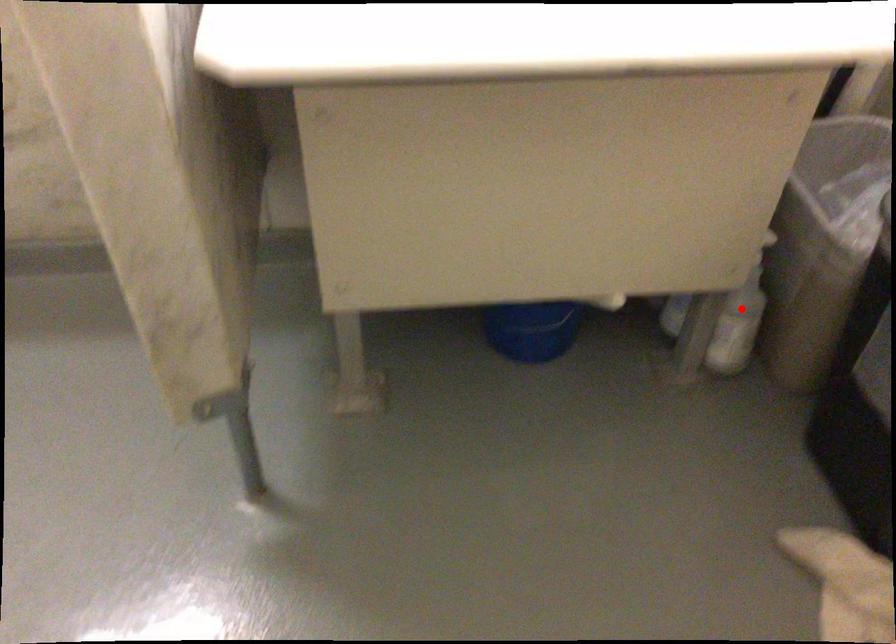
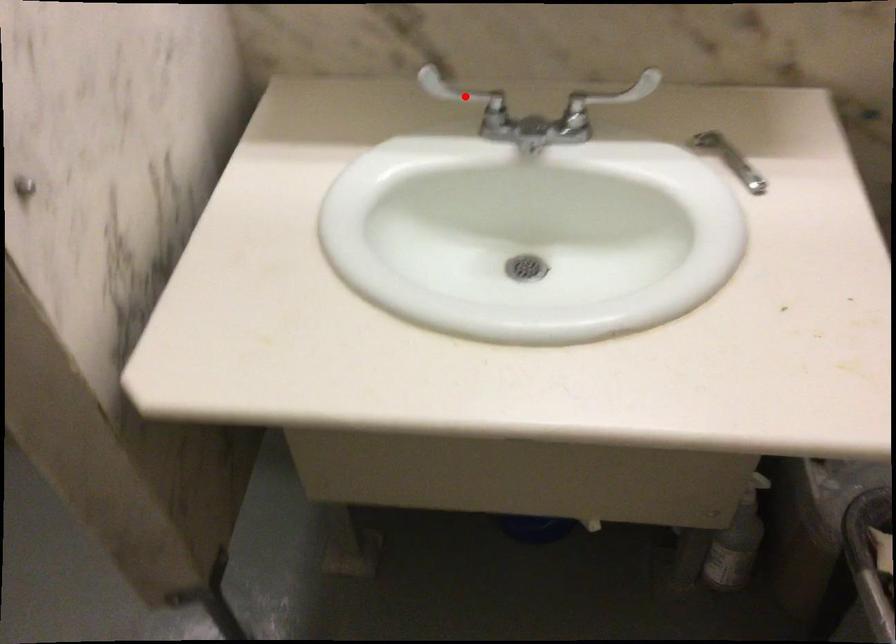
I am providing you with two images of the same scene from different viewpoints. A red point is marked on the first image and another point is marked on the second image. Do the highlighted points in image1 and image2 indicate the same real-world spot?

No